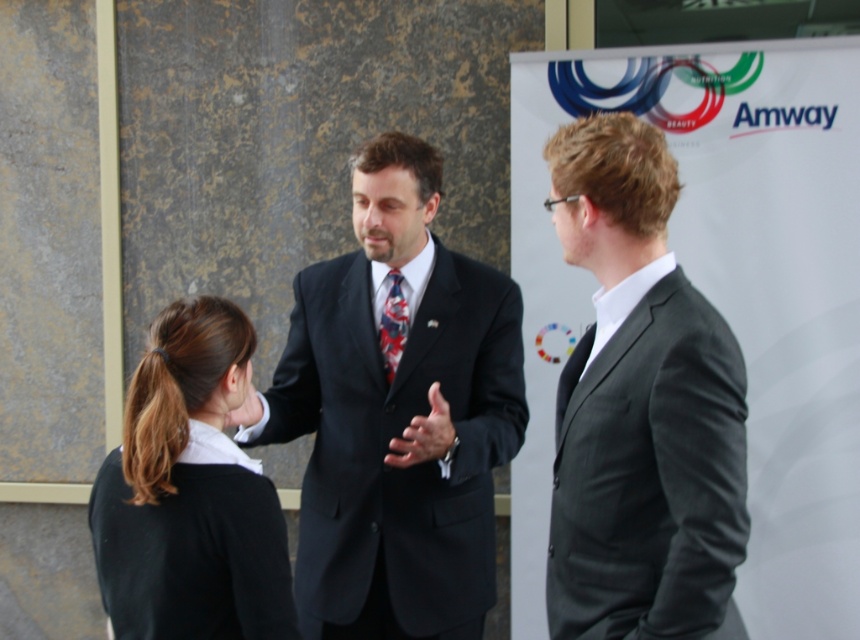
You are an event photographer at the Amway conference. You need to capture a clear shot of the blue patterned tie at center without the matte black hand at center blocking it. What adjustment should you make to your camera angle?

To avoid the matte black hand at center blocking the blue patterned tie at center, you should adjust your camera angle to position it behind the hand so that the tie becomes visible.

Consider the image. You are a photographer standing 3 meters away from the scene. You want to take a photo of the blue patterned tie at center without the matte black hand at center blocking it. Is this possible given their current positions?

The matte black hand at center and blue patterned tie at center are 21.59 centimeters apart from each other. Since they are only about 21.59 cm apart, the hand might still block the tie in the photo unless you adjust your angle or move closer. However, since you are already 3 meters away, moving closer might not significantly change the perspective. It might be challenging to avoid the hand blocking the tie without repositioning either the subjects or the camera angle.